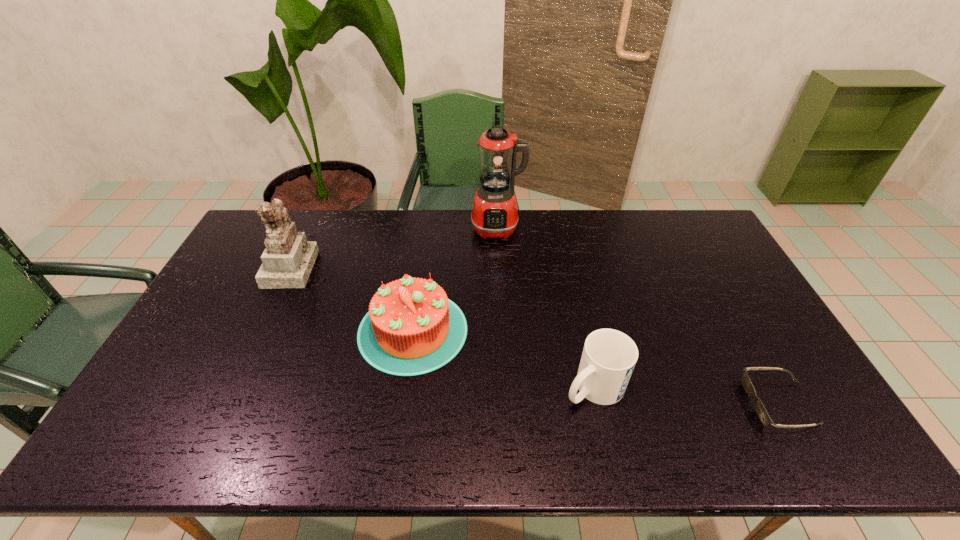
Find the location of a particular element. Image resolution: width=960 pixels, height=540 pixels. free point between the third shortest object and the farthest object is located at coordinates (455, 279).

This screenshot has width=960, height=540. Find the location of `vacant area that lies between the rightmost object and the leftmost object`. vacant area that lies between the rightmost object and the leftmost object is located at coordinates 535,335.

I want to click on vacant space in between the leftmost object and the cake, so click(x=351, y=299).

Locate an element on the screen. blank region between the tallest object and the mug is located at coordinates (545, 308).

The width and height of the screenshot is (960, 540). I want to click on unoccupied position between the farthest object and the second object from left to right, so click(x=455, y=279).

This screenshot has width=960, height=540. I want to click on free spot between the mug and the cake, so click(x=503, y=359).

The width and height of the screenshot is (960, 540). Find the location of `free space between the food processor and the second object from left to right`. free space between the food processor and the second object from left to right is located at coordinates (455, 279).

Where is `the fourth closest object to the food processor`? The height and width of the screenshot is (540, 960). the fourth closest object to the food processor is located at coordinates (761, 411).

Identify the location of object that stands as the second closest to the mug. [761, 411].

This screenshot has width=960, height=540. I want to click on free location that satisfies the following two spatial constraints: 1. on the front-facing side of the fourth object from left to right; 2. on the left side of the second farthest object, so click(x=234, y=387).